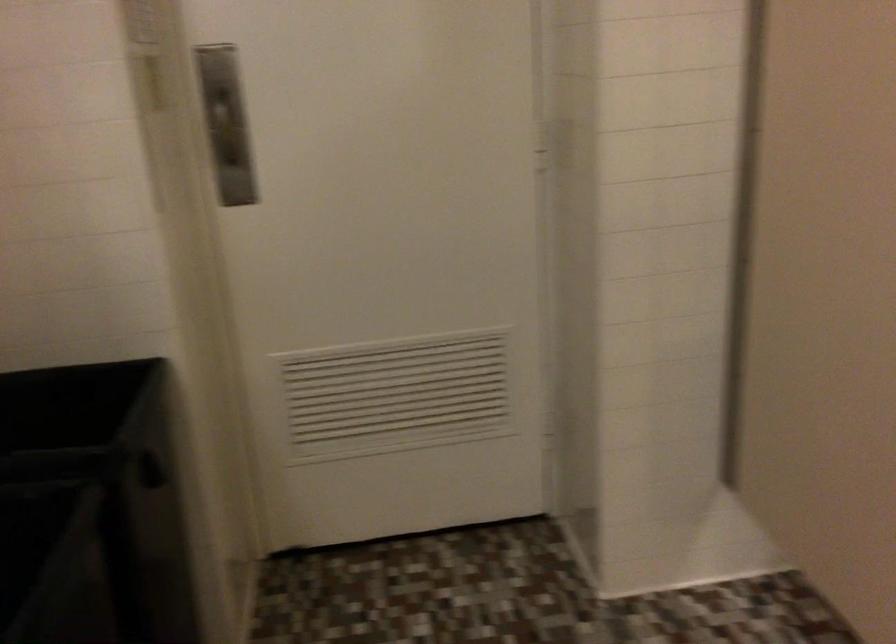
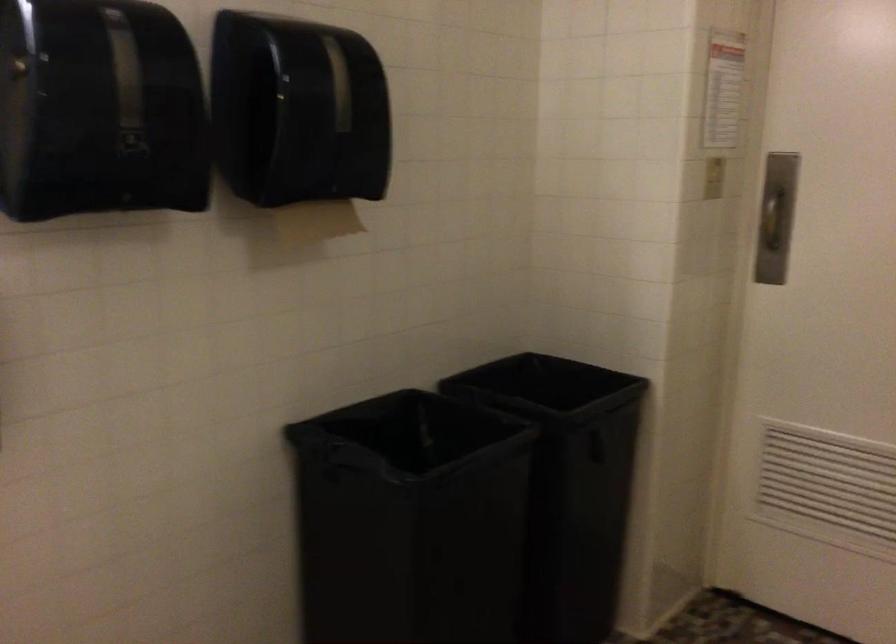
Question: I am providing you with two images of the same scene from different viewpoints. Which of the following objects are not visible in image2?

Choices:
 (A) metal door handle
 (B) black trash can
 (C) paper towel
 (D) none of these

Answer: (D)